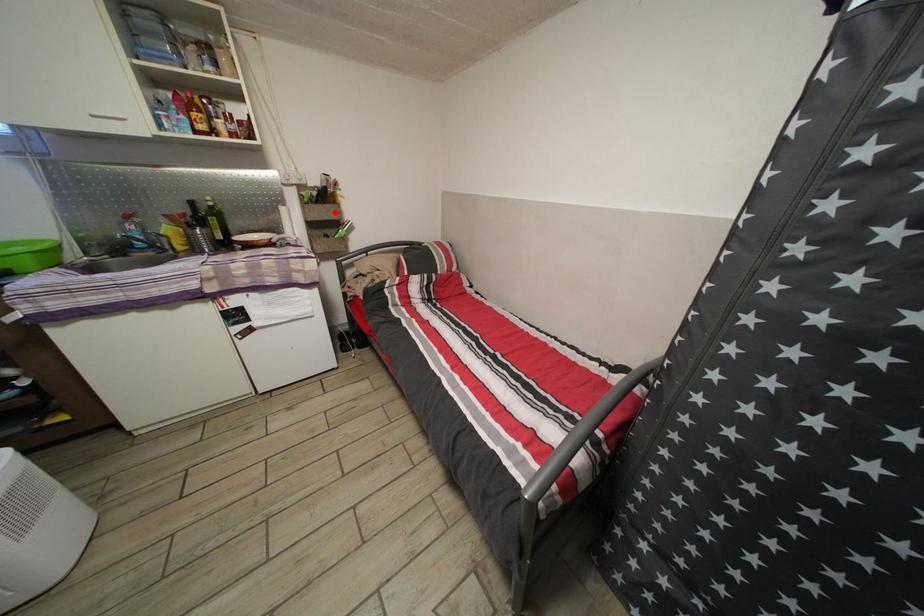
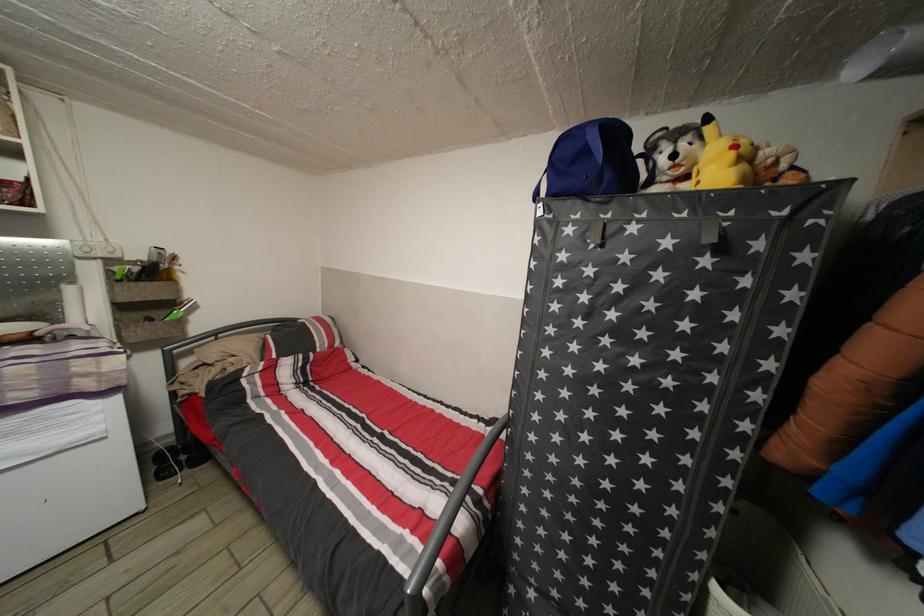
Locate, in the second image, the point that corresponds to the highlighted location in the first image.

(164, 291)